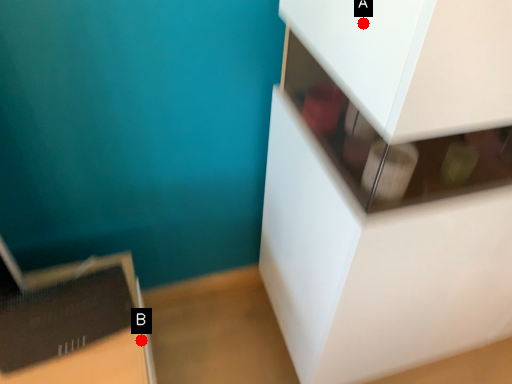
Question: Two points are circled on the image, labeled by A and B beside each circle. Which point is closer to the camera?

Choices:
 (A) A is closer
 (B) B is closer

Answer: (A)